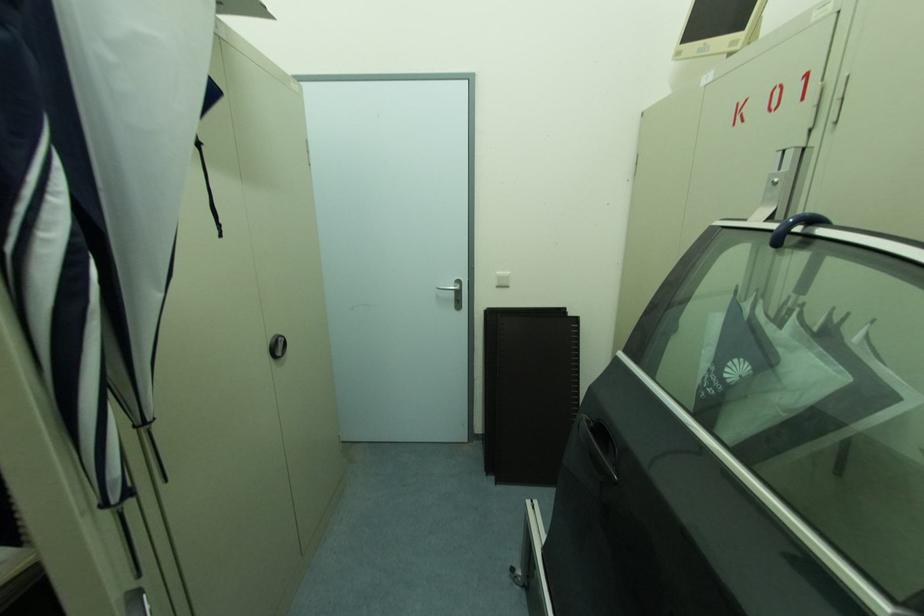
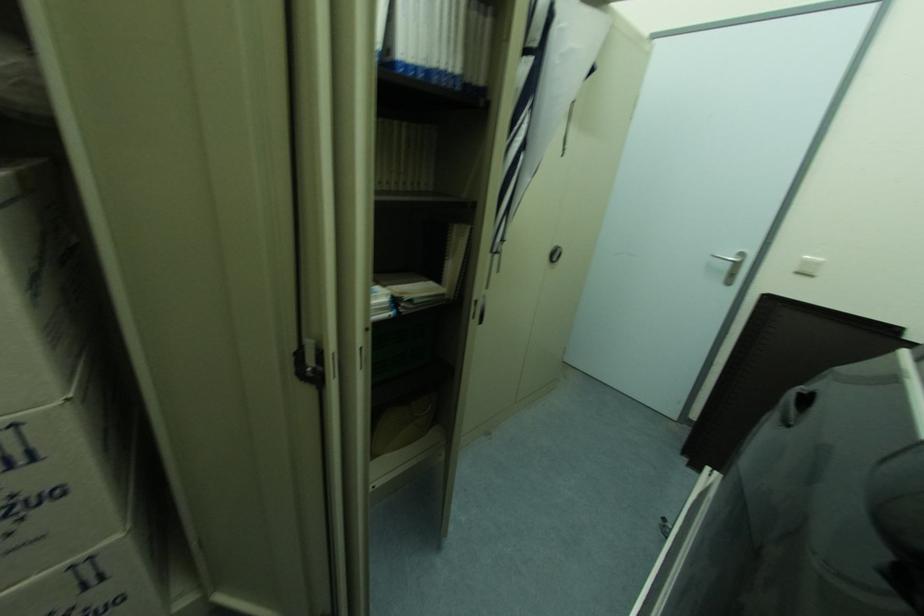
Question: The camera is either moving clockwise (left) or counter-clockwise (right) around the object. The first image is from the beginning of the video and the second image is from the end. Is the camera moving left or right when shooting the video?

Choices:
 (A) Left
 (B) Right

Answer: (B)